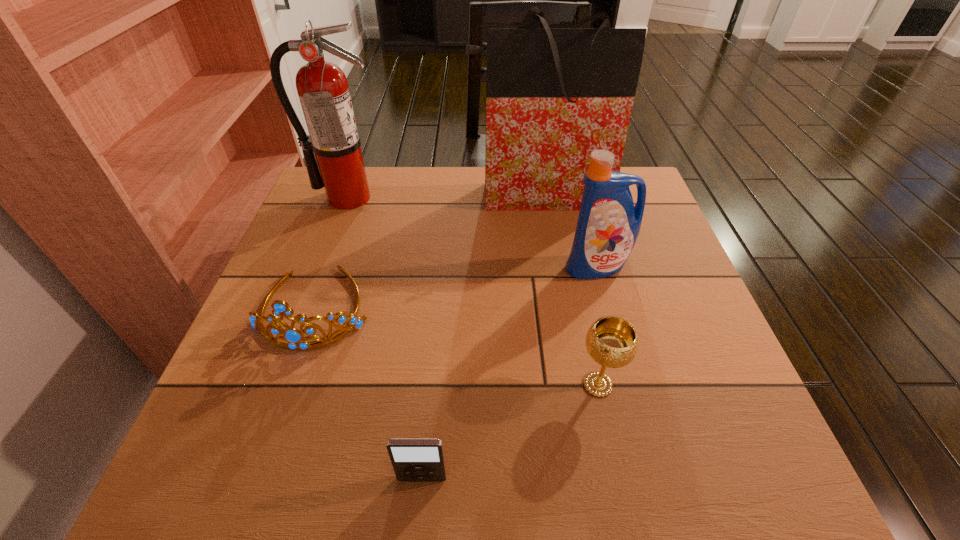
You are a GUI agent. You are given a task and a screenshot of the screen. Output one action in this format:
    pyautogui.click(x=<x>, y=<y>)
    Task: Click on the vacant point located 0.070m on the right of the chalice
    
    Given the screenshot: What is the action you would take?
    pyautogui.click(x=659, y=384)

Image resolution: width=960 pixels, height=540 pixels. What are the coordinates of `vacant space located 0.150m on the front-facing side of the tiara` in the screenshot? It's located at (274, 429).

What are the coordinates of `shopping bag present at the far edge` in the screenshot? It's located at (553, 95).

Find the location of a particular element. fire extinguisher that is at the far edge is located at coordinates (322, 87).

Where is `object located at the near edge`? The width and height of the screenshot is (960, 540). object located at the near edge is located at coordinates (413, 459).

Locate an element on the screen. The image size is (960, 540). fire extinguisher that is at the left edge is located at coordinates (322, 87).

You are a GUI agent. You are given a task and a screenshot of the screen. Output one action in this format:
    pyautogui.click(x=<x>, y=<y>)
    Task: Click on the tiara that is at the left edge
    
    Given the screenshot: What is the action you would take?
    pyautogui.click(x=292, y=335)

Locate an element on the screen. shopping bag at the right edge is located at coordinates (553, 95).

Locate an element on the screen. This screenshot has height=540, width=960. detergent present at the right edge is located at coordinates (608, 225).

Locate an element on the screen. The width and height of the screenshot is (960, 540). object that is at the far left corner is located at coordinates (322, 87).